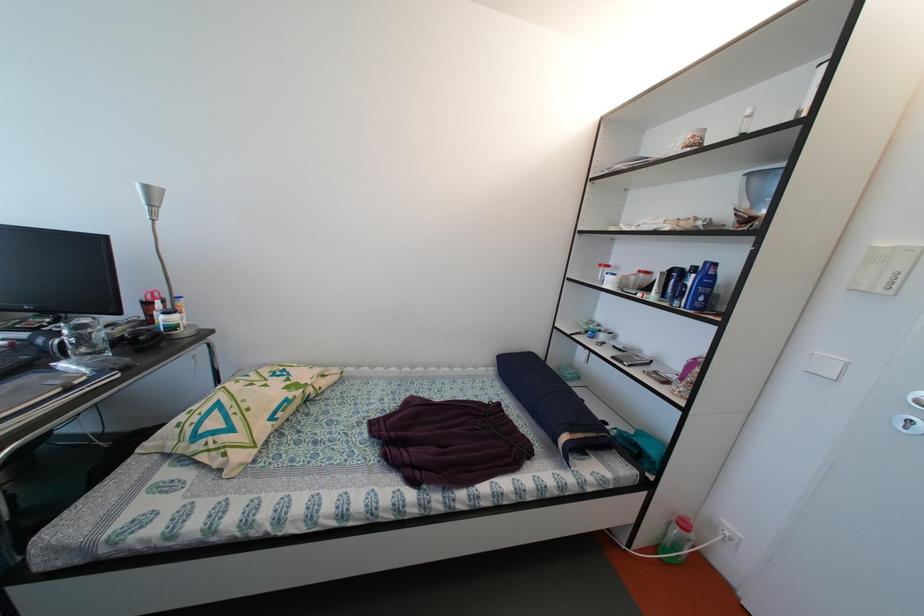
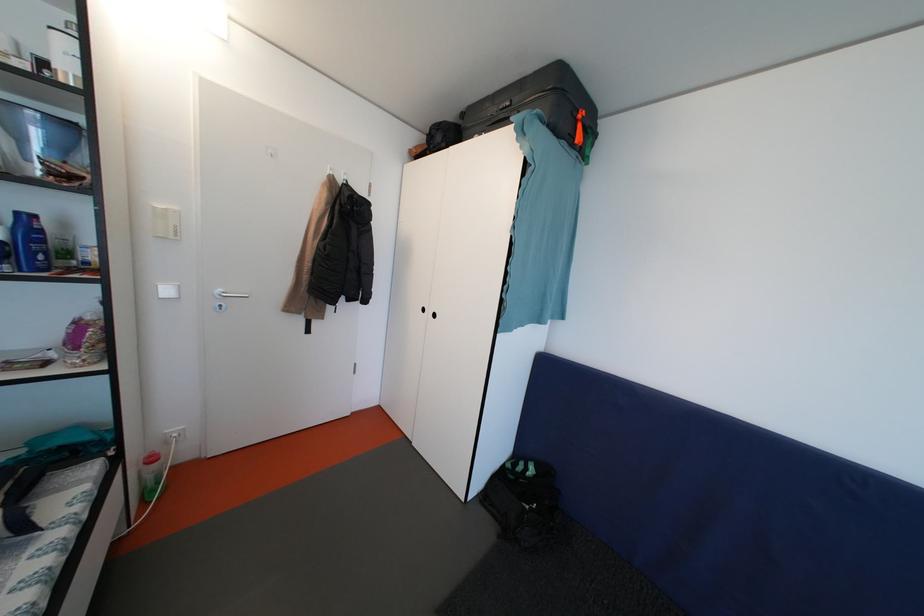
In the second image, find the point that corresponds to pixel 709 304 in the first image.

(49, 262)